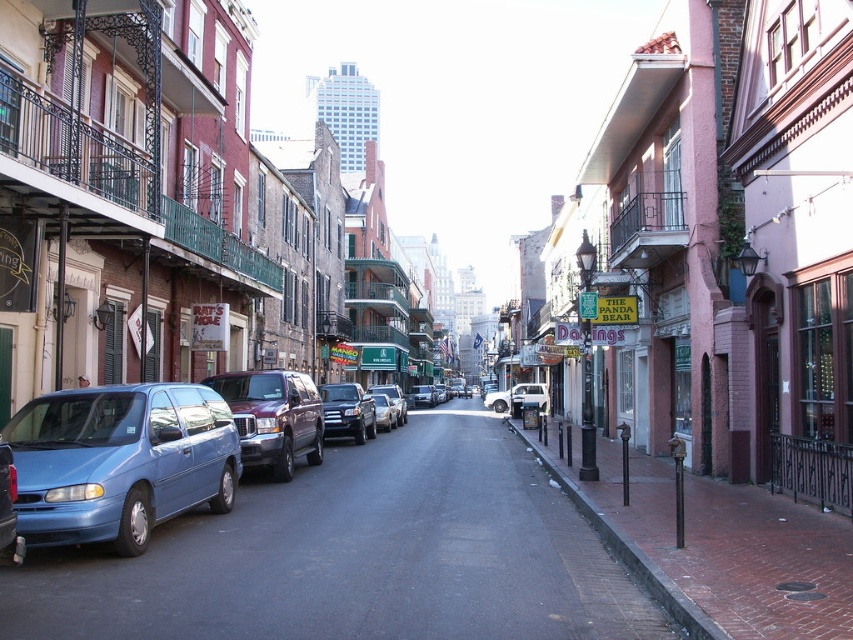
Question: Does matte blue van at lower left appear over maroon metallic suv at left?

Choices:
 (A) yes
 (B) no

Answer: (A)

Question: Which point appears farthest from the camera in this image?

Choices:
 (A) (413, 548)
 (B) (386, 419)

Answer: (B)

Question: Does maroon metallic suv at left appear under metallic silver sedan at center?

Choices:
 (A) yes
 (B) no

Answer: (B)

Question: Is blue metallic van at center-left closer to camera compared to shiny silver suv at center?

Choices:
 (A) yes
 (B) no

Answer: (A)

Question: Estimate the real-world distances between objects in this image. Which object is closer to the silver metallic sedan at center?

Choices:
 (A) matte blue van at lower left
 (B) satin black suv at center
 (C) brass metal fire hydrant at lower right
 (D) metallic silver car at center

Answer: (D)

Question: Estimate the real-world distances between objects in this image. Which object is farther from the maroon metallic suv at left?

Choices:
 (A) metallic silver car at center
 (B) shiny silver suv at center
 (C) silver metallic sedan at center
 (D) metallic silver sedan at center

Answer: (D)